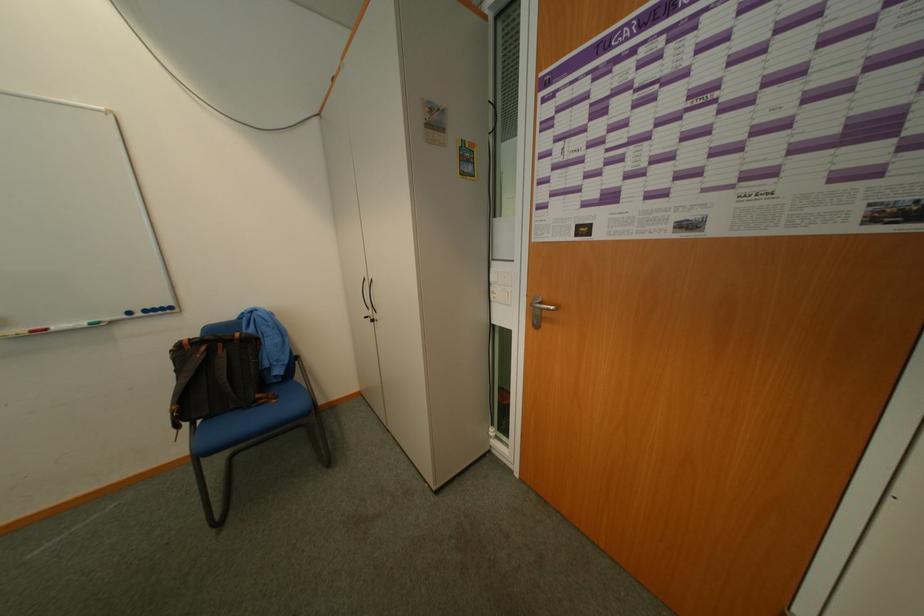
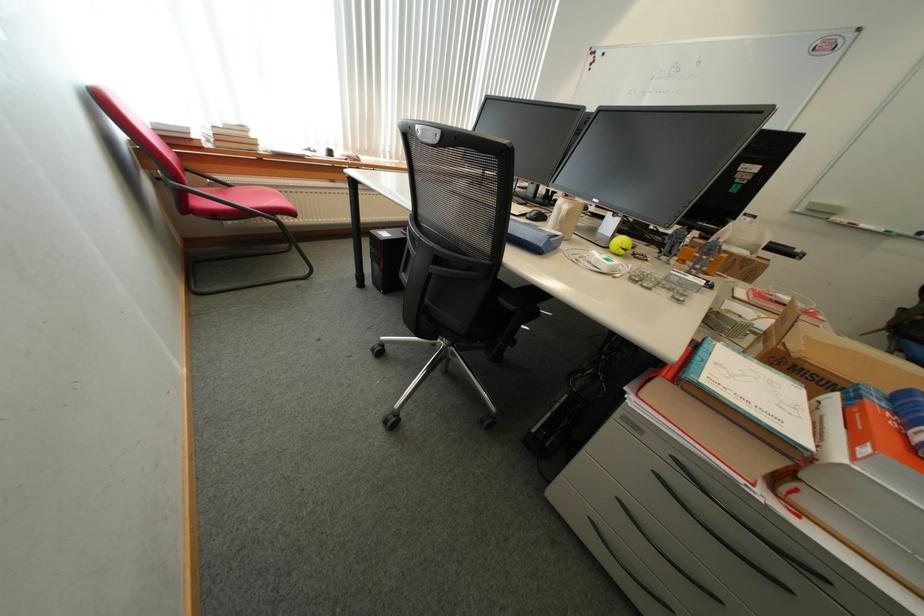
Question: I am providing you with two images of the same scene from different viewpoints. Which of the following objects are not visible in image2?

Choices:
 (A) cardboard box
 (B) beige ceramic mug
 (C) cabinet drawer handle
 (D) none of these

Answer: (D)